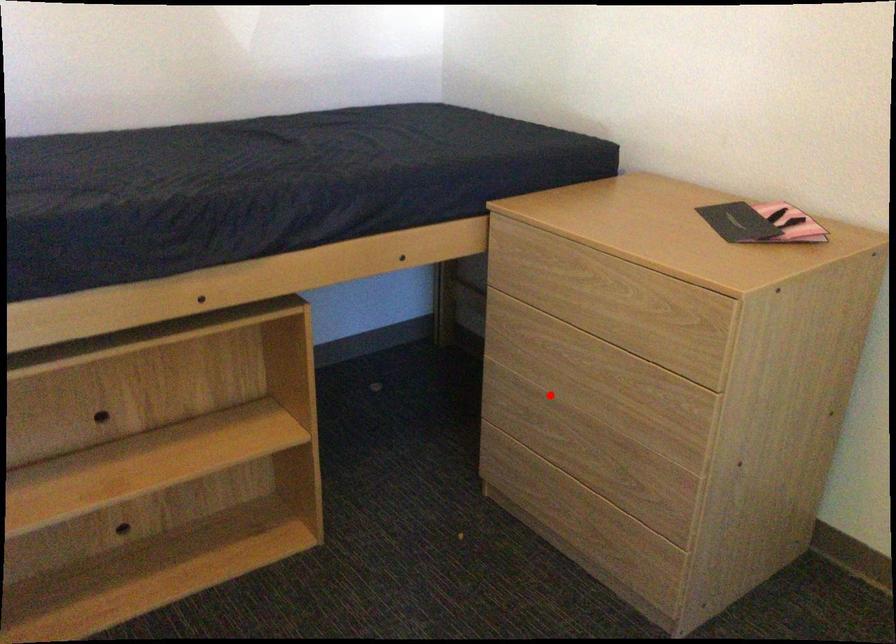
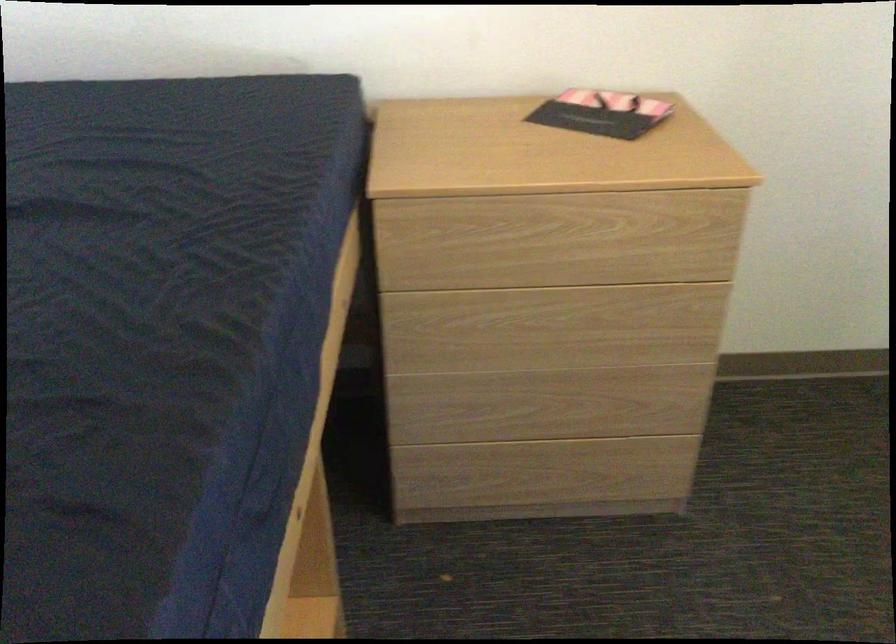
Question: I am providing you with two images of the same scene from different viewpoints. Given a red point in image1, look at the same physical point in image2. Is it:

Choices:
 (A) Closer to the viewpoint
 (B) Farther from the viewpoint

Answer: (A)